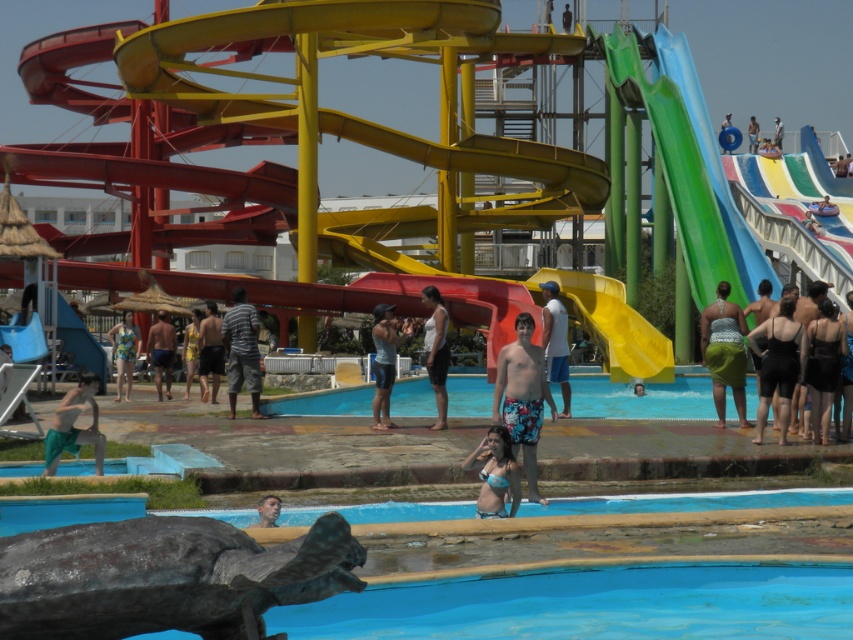
You are a guest at the water park and you want to locate the multicolored swimsuit at center. From your current position at the yellow rubber slide at center, in which direction should you move to find it?

The multicolored swimsuit at center is to the left of the yellow rubber slide at center, so you should move to your left to find it.

You are standing at the water park and want to take a photo of the point at coordinates point (780, 349). Given that your camera has a maximum focus range of 50 meters, will you be able to focus on it clearly?

The distance of point (780, 349) from viewer is 55.65 meters, which exceeds the camera maximum focus range of 50 meters. So you won be able to focus on it clearly.

You are at the water park and see a person in a black swimsuit at center and another in blue shorts at center. Which swimmer is positioned to the left?

The black swimsuit at center is to the left of the blue shorts at center.